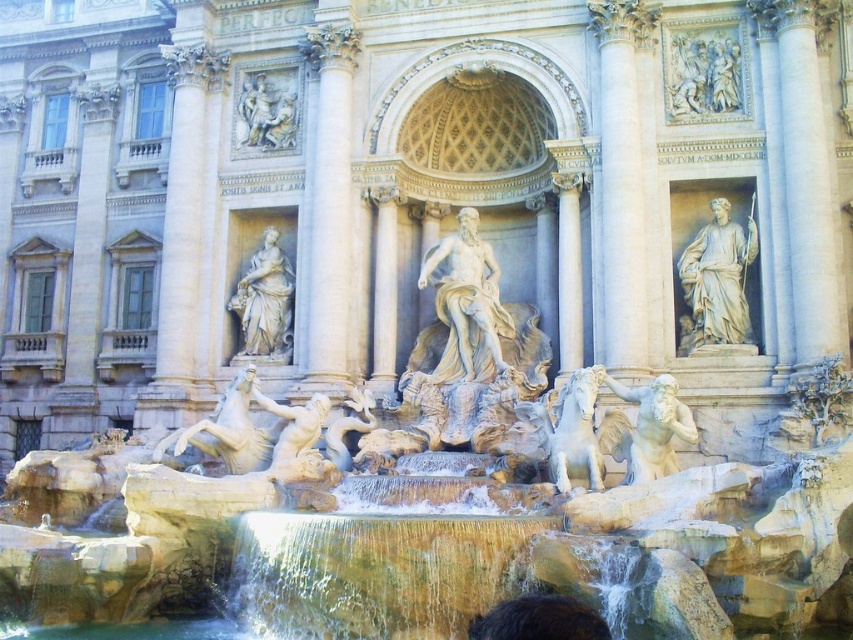
Question: Is white marble statue at center-left bigger than white marble horse at center?

Choices:
 (A) no
 (B) yes

Answer: (A)

Question: Estimate the real-world distances between objects in this image. Which object is farther from the white marble statue at center-left?

Choices:
 (A) white marble statue at center
 (B) white marble relief at upper right

Answer: (B)

Question: Does white marble statue at center have a smaller size compared to white marble relief at upper right?

Choices:
 (A) yes
 (B) no

Answer: (B)

Question: Which of the following is the farthest from the observer?

Choices:
 (A) white marble statue at upper center
 (B) smooth stone figure at center

Answer: (A)

Question: Among these objects, which one is farthest from the camera?

Choices:
 (A) white marble statue at center
 (B) white marble statue at right

Answer: (A)

Question: Does white marble column at upper left appear over white marble statue at center-left?

Choices:
 (A) yes
 (B) no

Answer: (A)